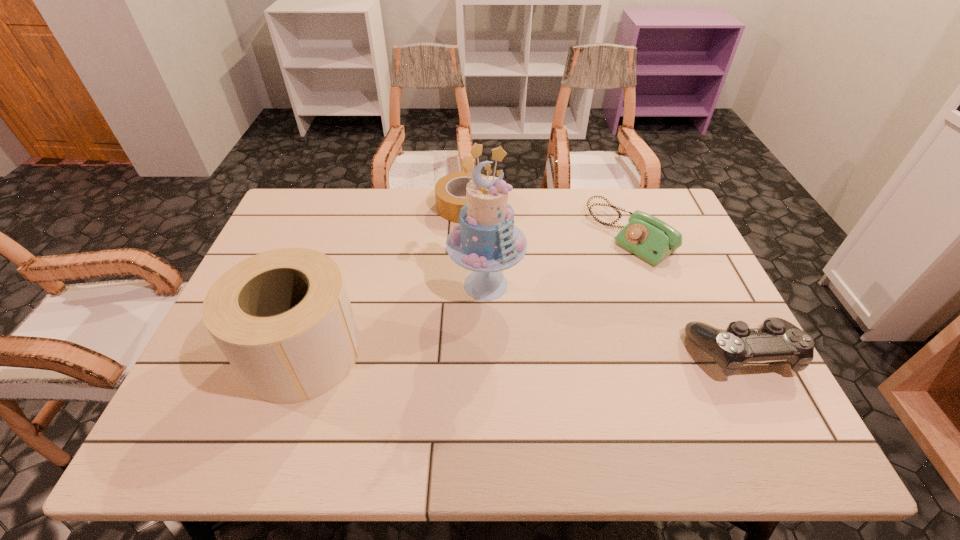
You are a GUI agent. You are given a task and a screenshot of the screen. Output one action in this format:
    pyautogui.click(x=<x>, y=<y>)
    Task: Click on the vacant point located between the control and the leftmost object
    Image resolution: width=960 pixels, height=540 pixels.
    Given the screenshot: What is the action you would take?
    pyautogui.click(x=521, y=352)

The width and height of the screenshot is (960, 540). I want to click on free area in between the control and the cake, so click(613, 319).

Where is `vacant area that lies between the leftmost object and the control`? The height and width of the screenshot is (540, 960). vacant area that lies between the leftmost object and the control is located at coordinates (521, 352).

Locate an element on the screen. The height and width of the screenshot is (540, 960). the closest object to the duct tape is located at coordinates (486, 241).

Where is `object that is the closest to the control`? The image size is (960, 540). object that is the closest to the control is located at coordinates (648, 237).

The image size is (960, 540). I want to click on vacant point that satisfies the following two spatial constraints: 1. on the front side of the control; 2. on the right side of the telephone, so click(675, 353).

Where is `free point that satisfies the following two spatial constraints: 1. on the back side of the telephone; 2. on the left side of the tallest object`? free point that satisfies the following two spatial constraints: 1. on the back side of the telephone; 2. on the left side of the tallest object is located at coordinates (486, 234).

You are a GUI agent. You are given a task and a screenshot of the screen. Output one action in this format:
    pyautogui.click(x=<x>, y=<y>)
    Task: Click on the vacant space that satisfies the following two spatial constraints: 1. on the front side of the control; 2. on the left side of the duct tape
    Image resolution: width=960 pixels, height=540 pixels.
    Given the screenshot: What is the action you would take?
    pyautogui.click(x=460, y=353)

Locate an element on the screen. This screenshot has height=540, width=960. free location that satisfies the following two spatial constraints: 1. on the back side of the second tallest object; 2. on the right side of the tallest object is located at coordinates (325, 285).

At what (x,y) coordinates should I click in order to perform the action: click on vacant space that satisfies the following two spatial constraints: 1. on the front side of the tallest object; 2. on the right side of the control. Please return your answer as a coordinate pair (x, y). The width and height of the screenshot is (960, 540). Looking at the image, I should click on (487, 353).